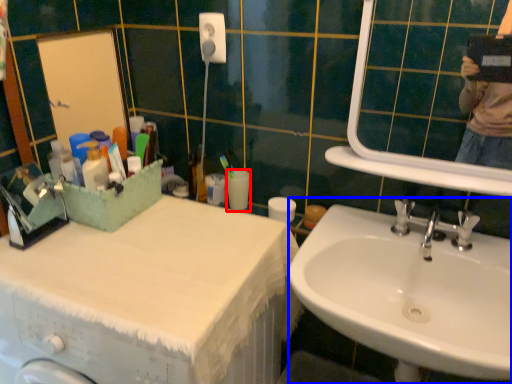
Question: Which object is further to the camera taking this photo, toilet paper (highlighted by a red box) or sink (highlighted by a blue box)?

Choices:
 (A) toilet paper
 (B) sink

Answer: (A)